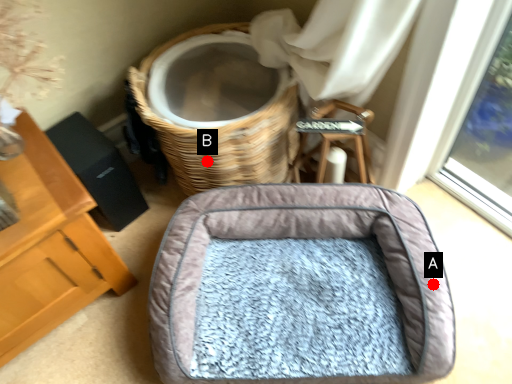
Question: Two points are circled on the image, labeled by A and B beside each circle. Which point is closer to the camera?

Choices:
 (A) A is closer
 (B) B is closer

Answer: (A)